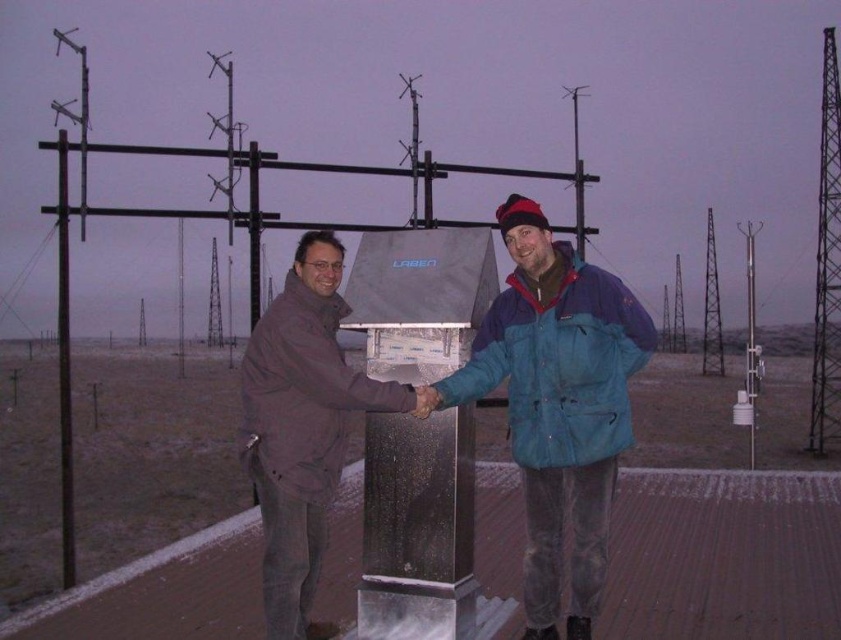
Question: Is blue fabric jacket at center positioned at the back of smooth black pole at left?

Choices:
 (A) no
 (B) yes

Answer: (A)

Question: Is blue fabric jacket at center to the left of brown matte jacket at center from the viewer's perspective?

Choices:
 (A) yes
 (B) no

Answer: (B)

Question: Does metallic lattice tower at right appear over smooth black pole at left?

Choices:
 (A) yes
 (B) no

Answer: (A)

Question: Which point is farther to the camera?

Choices:
 (A) brown matte jacket at center
 (B) blue fabric jacket at center
 (C) smooth black pole at left

Answer: (C)

Question: Among these points, which one is farthest from the camera?

Choices:
 (A) (817, 394)
 (B) (64, 138)
 (C) (533, 218)

Answer: (A)

Question: Which point is closer to the camera?

Choices:
 (A) smooth black pole at left
 (B) brown matte jacket at center

Answer: (B)